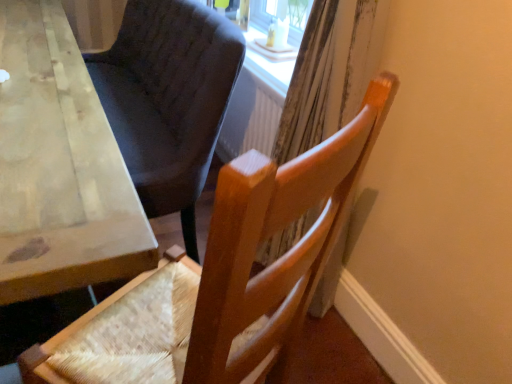
Question: Is wooden curtain at right not inside wooden table at left?

Choices:
 (A) yes
 (B) no

Answer: (A)

Question: From a real-world perspective, is wooden curtain at right positioned under wooden table at left based on gravity?

Choices:
 (A) no
 (B) yes

Answer: (A)

Question: Considering the relative sizes of wooden curtain at right and wooden table at left in the image provided, is wooden curtain at right wider than wooden table at left?

Choices:
 (A) no
 (B) yes

Answer: (A)

Question: Is the position of wooden curtain at right less distant than that of wooden table at left?

Choices:
 (A) no
 (B) yes

Answer: (A)

Question: Does wooden curtain at right have a lesser height compared to wooden table at left?

Choices:
 (A) no
 (B) yes

Answer: (A)

Question: Relative to wooden chair at center, is wooden table at left in front or behind?

Choices:
 (A) behind
 (B) front

Answer: (A)

Question: In terms of width, does wooden table at left look wider or thinner when compared to wooden chair at center?

Choices:
 (A) wide
 (B) thin

Answer: (B)

Question: Considering the positions of wooden table at left and wooden chair at center in the image, is wooden table at left bigger or smaller than wooden chair at center?

Choices:
 (A) big
 (B) small

Answer: (A)

Question: From a real-world perspective, relative to wooden chair at center, is wooden table at left vertically above or below?

Choices:
 (A) below
 (B) above

Answer: (A)

Question: Is wooden chair at center in front of or behind wooden table at left in the image?

Choices:
 (A) front
 (B) behind

Answer: (A)

Question: Is wooden chair at center wider or thinner than wooden table at left?

Choices:
 (A) wide
 (B) thin

Answer: (A)

Question: Based on their sizes in the image, would you say wooden chair at center is bigger or smaller than wooden table at left?

Choices:
 (A) big
 (B) small

Answer: (B)

Question: From the image's perspective, is wooden chair at center above or below wooden table at left?

Choices:
 (A) below
 (B) above

Answer: (A)

Question: Is wooden chair at center taller or shorter than wooden curtain at right?

Choices:
 (A) tall
 (B) short

Answer: (B)

Question: Is wooden chair at center inside the boundaries of wooden curtain at right, or outside?

Choices:
 (A) inside
 (B) outside

Answer: (B)